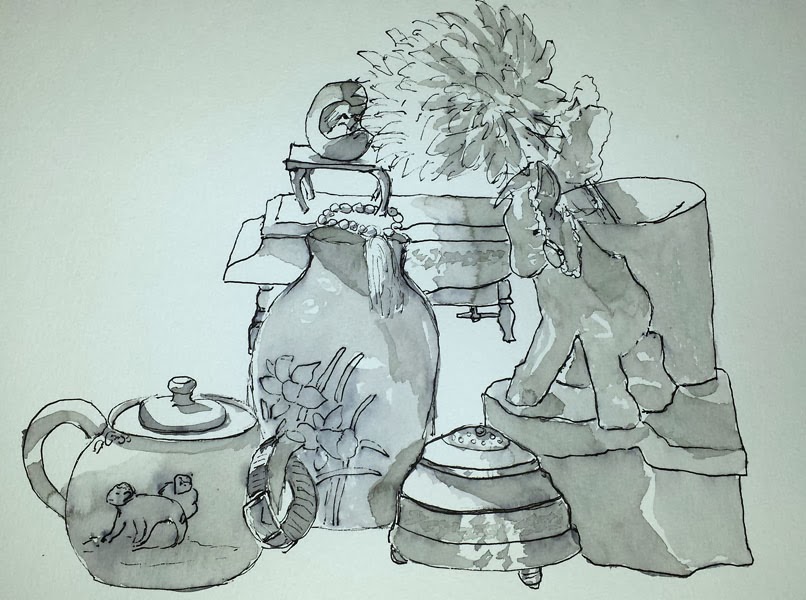
At what (x,y) coordinates should I click in order to perform the action: click on piano. Please return your answer as a coordinate pair (x, y). Looking at the image, I should click on (268, 257).